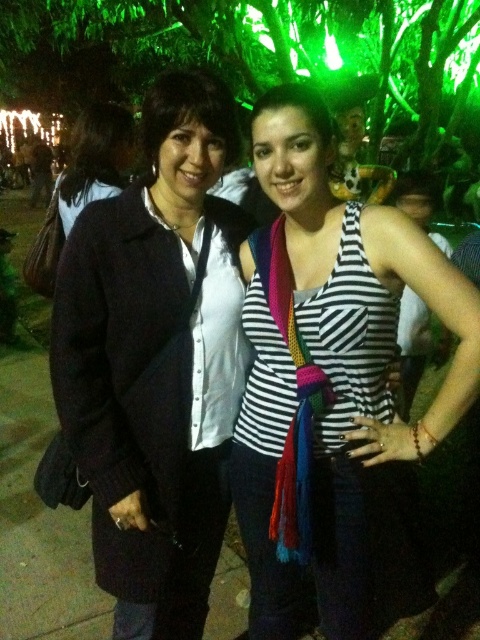
You are a photographer trying to capture a clear shot of both the striped fabric tank top at center and the dark blue sweater at left. Which clothing item is positioned lower in the frame?

The striped fabric tank top at center is positioned lower in the frame than the dark blue sweater at left.

You are standing at the point labeled as point (424, 442). You want to take a photo of the two people in the scene using a camera that has a maximum focus range of 5 feet. Will the camera be able to focus on the two people if you are at that point?

The point labeled as point (424, 442) and the camera are 4.68 feet apart from each other. Since the camera has a maximum focus range of 5 feet, the distance of 4.68 feet is within the limit. Therefore, the camera will be able to focus on the two people when positioned at that point.

You are trying to identify clothing items in the scene. According to the image, which sweater is closer to you, the matte black sweater at left or the dark blue sweater at left?

The matte black sweater at left is closer to you because it is in front of the dark blue sweater at left.